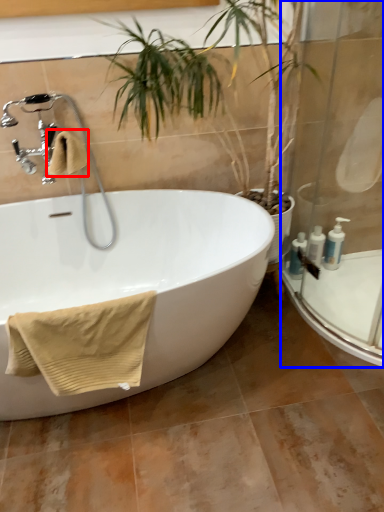
Question: Which object is closer to the camera taking this photo, bath towel (highlighted by a red box) or shower door (highlighted by a blue box)?

Choices:
 (A) bath towel
 (B) shower door

Answer: (B)